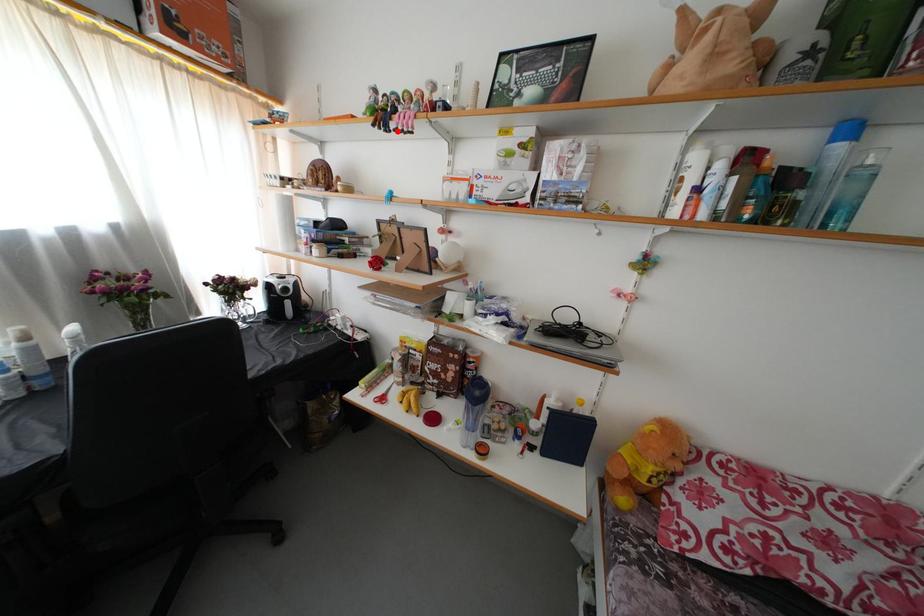
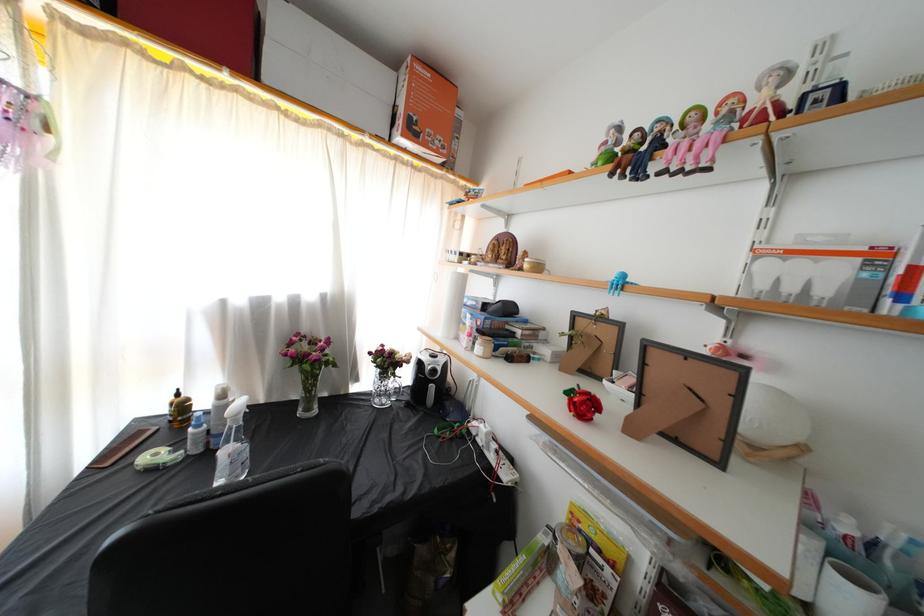
The point at the highlighted location is marked in the first image. Where is the corresponding point in the second image?

(659, 172)